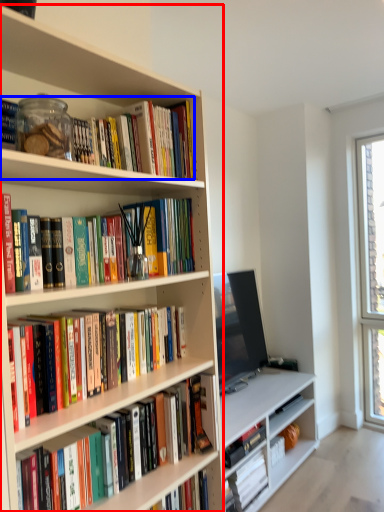
Question: Which point is further to the camera, bookcase (highlighted by a red box) or book (highlighted by a blue box)?

Choices:
 (A) bookcase
 (B) book

Answer: (B)